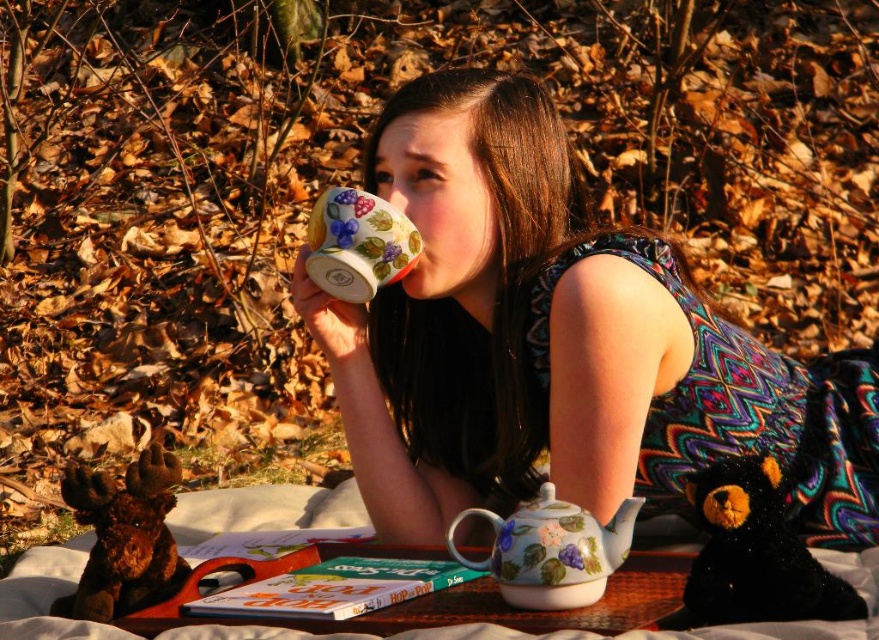
Consider the image. You are a photographer trying to capture the floral ceramic mug at upper center in the image. What are the exact coordinates where you should focus your camera to ensure the mug is centered in the frame?

The exact coordinates to focus on are 0.536 and 0.638 to center the floral ceramic mug at upper center in the frame.

You are a photographer taking a picture of the scene. You want to ensure both the floral ceramic mug at upper center and the black plush bear at lower right are clearly visible. Which object should you focus on first to ensure both are in frame?

The floral ceramic mug at upper center is positioned on the left side of black plush bear at lower right, so focusing on the black plush bear at lower right first would help ensure both are in frame since it is positioned further to the right.

You are a guest at a tea ceremony and need to pour tea from the floral porcelain teapot at lower center into the porcelain floral cup at upper center. Can you confirm if the cup will hold all the tea from the teapot?

The floral porcelain teapot at lower center has a larger size compared to porcelain floral cup at upper center. Therefore, the cup may not hold all the tea from the teapot as it is smaller in size.